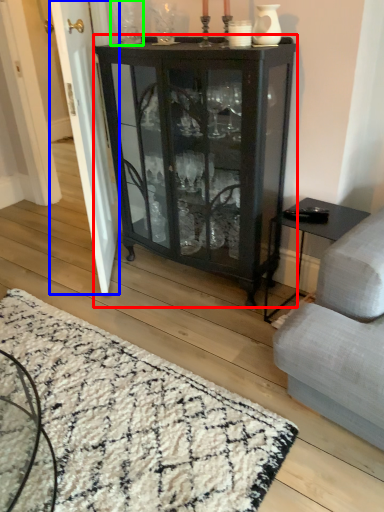
Question: Which object is positioned closest to cupboard (highlighted by a red box)? Select from screen door (highlighted by a blue box) and glass vase (highlighted by a green box).

Choices:
 (A) screen door
 (B) glass vase

Answer: (A)